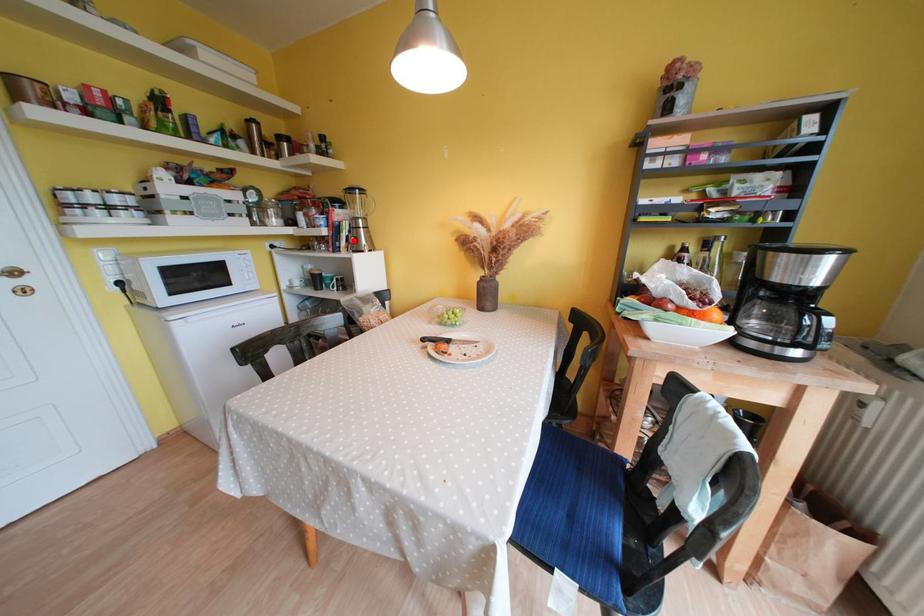
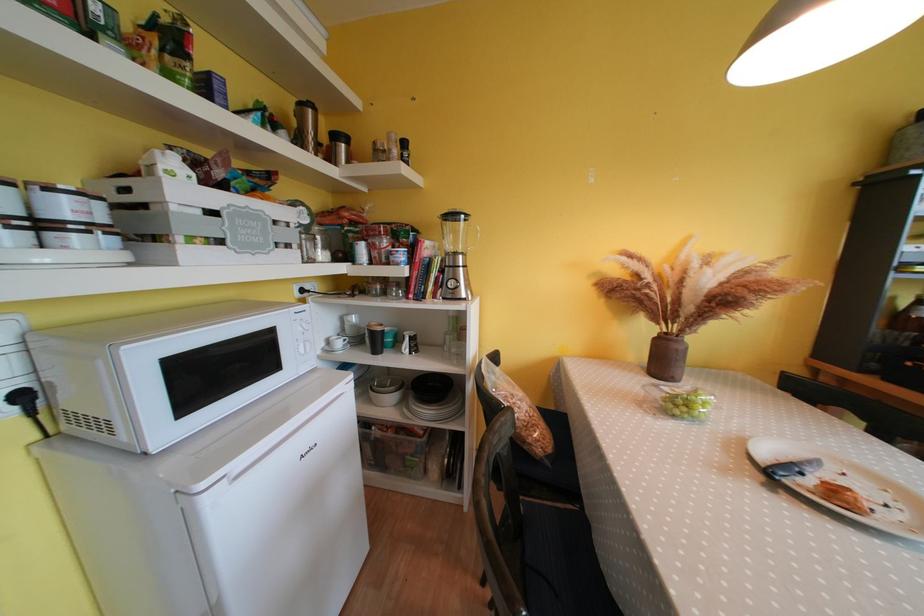
The point at the highlighted location is marked in the first image. Where is the corresponding point in the second image?

(444, 282)